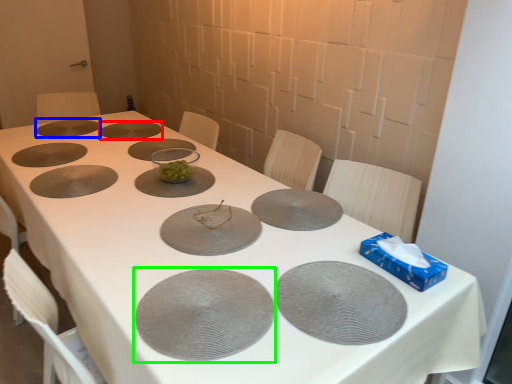
Question: Estimate the real-world distances between objects in this image. Which object is closer to glass plate (highlighted by a red box), glass plate (highlighted by a blue box) or glass plate (highlighted by a green box)?

Choices:
 (A) glass plate
 (B) glass plate

Answer: (A)